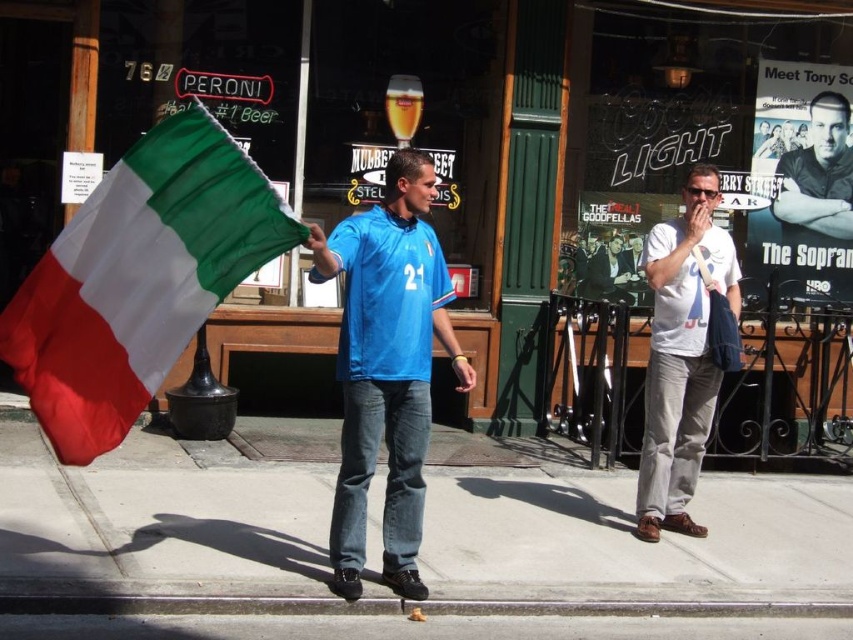
Question: Can you confirm if blue jersey at center is positioned to the left of white cotton t-shirt at right?

Choices:
 (A) no
 (B) yes

Answer: (B)

Question: In this image, where is polyester fabric flag at left located relative to blue jersey at center?

Choices:
 (A) above
 (B) below

Answer: (A)

Question: Which point is closer to the camera taking this photo?

Choices:
 (A) (776, 204)
 (B) (373, 234)
 (C) (169, 202)
 (D) (689, 275)

Answer: (C)

Question: Which point is closer to the camera taking this photo?

Choices:
 (A) (212, 189)
 (B) (842, 228)

Answer: (A)

Question: Which of the following is the closest to the observer?

Choices:
 (A) matte black suit at center
 (B) smooth black shirt at center

Answer: (B)

Question: Can you confirm if blue jersey at center is positioned below matte black suit at center?

Choices:
 (A) no
 (B) yes

Answer: (B)